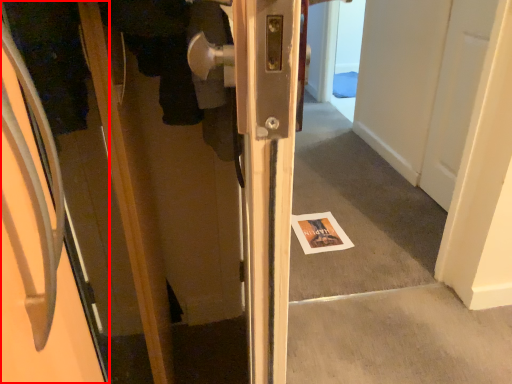
Question: From the image's perspective, what is the correct spatial relationship of door (annotated by the red box) in relation to magazine?

Choices:
 (A) below
 (B) above

Answer: (A)